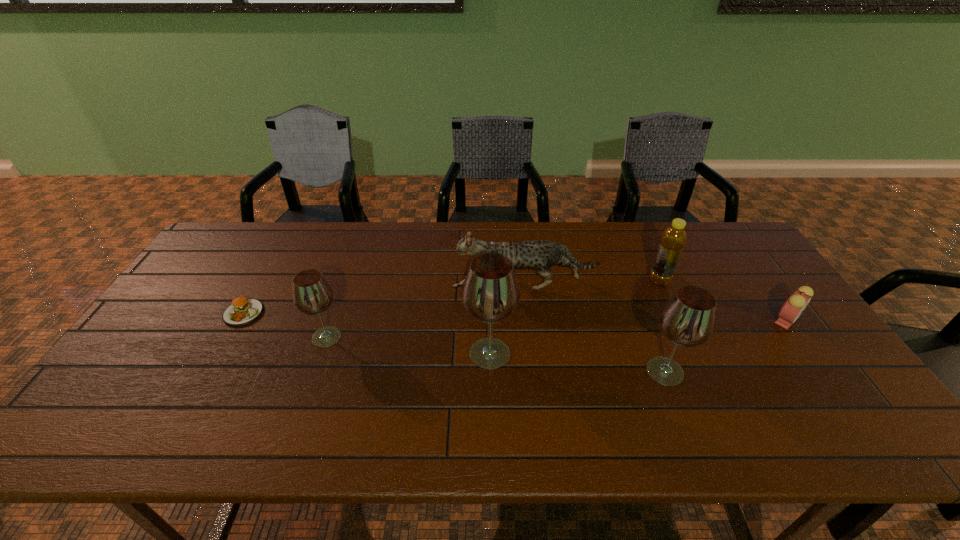
What are the coordinates of `the closest wineglass to the bottle` in the screenshot? It's located at (688, 318).

This screenshot has height=540, width=960. I want to click on free space that satisfies the following two spatial constraints: 1. on the front side of the leftmost wineglass; 2. on the right side of the second wineglass from left to right, so click(x=322, y=354).

Image resolution: width=960 pixels, height=540 pixels. Find the location of `free point that satisfies the following two spatial constraints: 1. on the back side of the leftmost wineglass; 2. on the left side of the bottle`. free point that satisfies the following two spatial constraints: 1. on the back side of the leftmost wineglass; 2. on the left side of the bottle is located at coordinates (347, 280).

The height and width of the screenshot is (540, 960). What are the coordinates of `vacant region that satisfies the following two spatial constraints: 1. on the face of the cat; 2. on the front side of the shortest wineglass` in the screenshot? It's located at click(530, 337).

Locate an element on the screen. This screenshot has height=540, width=960. free space in the image that satisfies the following two spatial constraints: 1. on the front side of the second shortest wineglass; 2. on the left side of the shortest wineglass is located at coordinates (315, 372).

I want to click on vacant area that satisfies the following two spatial constraints: 1. on the front side of the bottle; 2. on the face of the cat, so click(661, 286).